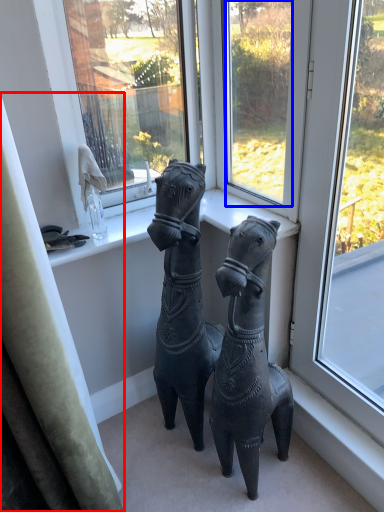
Question: Which object is closer to the camera taking this photo, curtain (highlighted by a red box) or window (highlighted by a blue box)?

Choices:
 (A) curtain
 (B) window

Answer: (A)